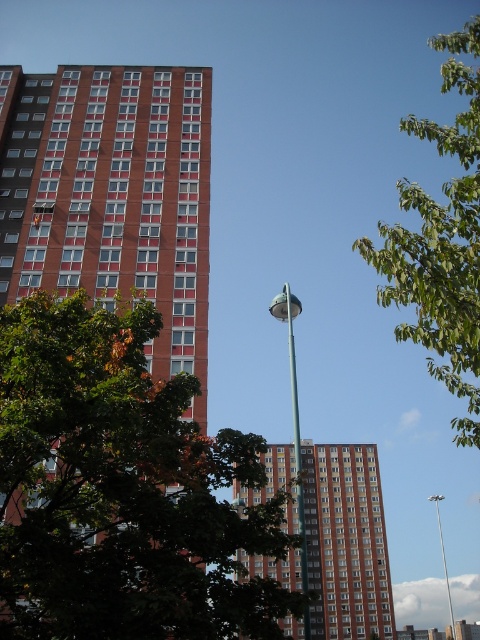
Question: Is green leafy tree at center smaller than satin silver pole at center?

Choices:
 (A) yes
 (B) no

Answer: (A)

Question: Based on their relative distances, which object is farther from the green leafy tree at center?

Choices:
 (A) green leafy tree at upper right
 (B) brown brick building at center
 (C) metallic pole at center
 (D) satin silver pole at center

Answer: (C)

Question: Is green leafy tree at center to the right of green leafy tree at upper right from the viewer's perspective?

Choices:
 (A) yes
 (B) no

Answer: (B)

Question: Based on their relative distances, which object is farther from the satin silver pole at center?

Choices:
 (A) brown brick building at center
 (B) green leafy tree at upper right
 (C) metallic pole at center
 (D) green leafy tree at center

Answer: (C)

Question: Which point is farther from the camera taking this photo?

Choices:
 (A) (291, 371)
 (B) (452, 612)
 (C) (398, 189)

Answer: (B)

Question: Where is satin silver pole at center located in relation to metallic pole at center in the image?

Choices:
 (A) left
 (B) right

Answer: (A)